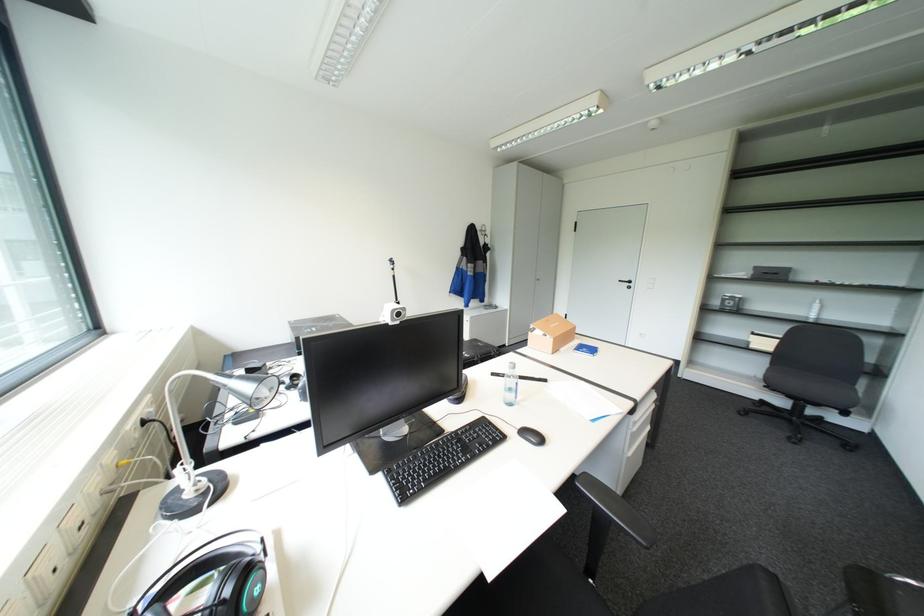
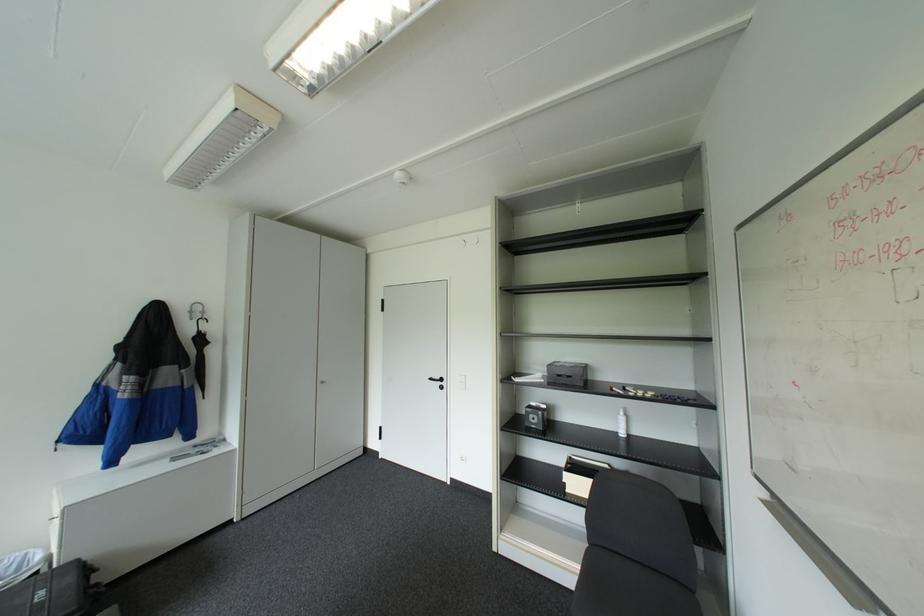
Where in the second image is the point corresponding to the point at 816,315 from the first image?

(626, 432)